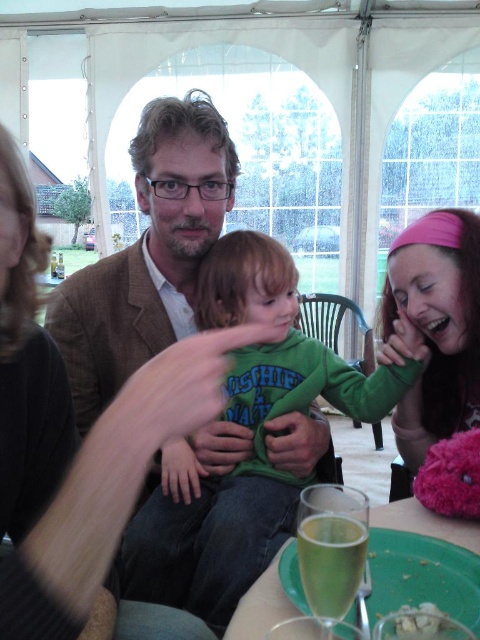
You are standing in the tented event space and want to take a photo of both the champagne glasses and the residential area outside. The champagne glasses are located at point [262,548] and the residential area is visible through the window at point [391,509]. Which point should you focus on first to ensure both are in the frame?

You should focus on point [262,548] first because it is closer to the camera than point [391,509], allowing you to capture both the champagne glasses and the residential area in the frame.

You are a photographer at the event and need to position a spotlight on the green cotton shirt at center without it shining on the pink fabric headband at lower right. Can you do this based on their positions?

The green cotton shirt at center is much taller than the pink fabric headband at lower right, so the spotlight can be angled upwards to illuminate the green cotton shirt at center without affecting the pink fabric headband at lower right.